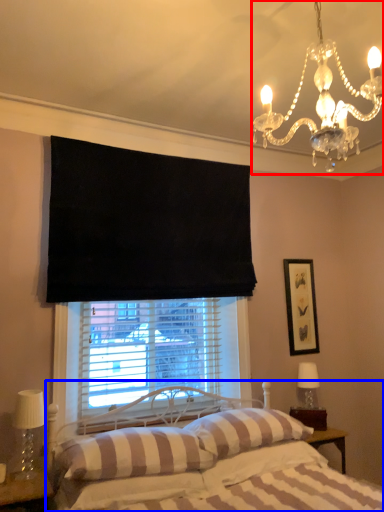
Question: Which point is further to the camera, light fixture (highlighted by a red box) or bed (highlighted by a blue box)?

Choices:
 (A) light fixture
 (B) bed

Answer: (A)